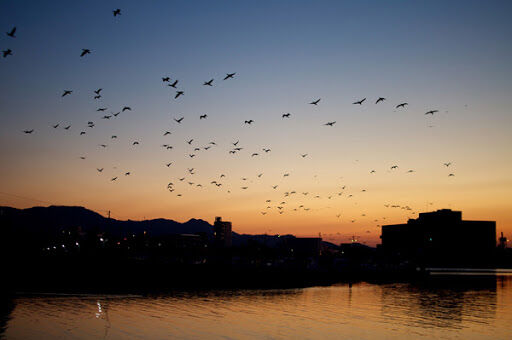
At what (x,y) coordinates should I click in order to perform the action: click on lights. Please return your answer as a coordinate pair (x, y). Image resolution: width=512 pixels, height=340 pixels. Looking at the image, I should click on (101, 240), (76, 243), (64, 247), (56, 247), (49, 247).